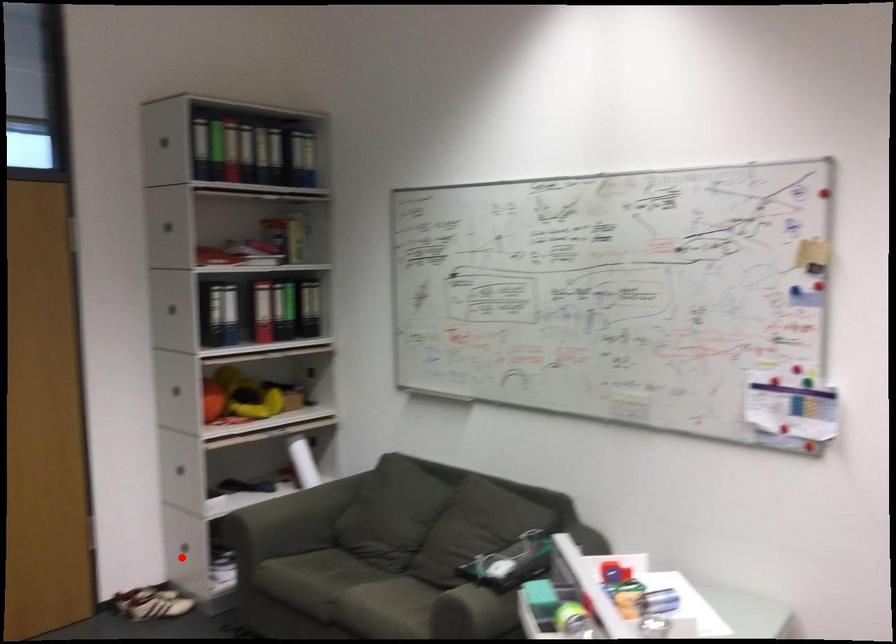
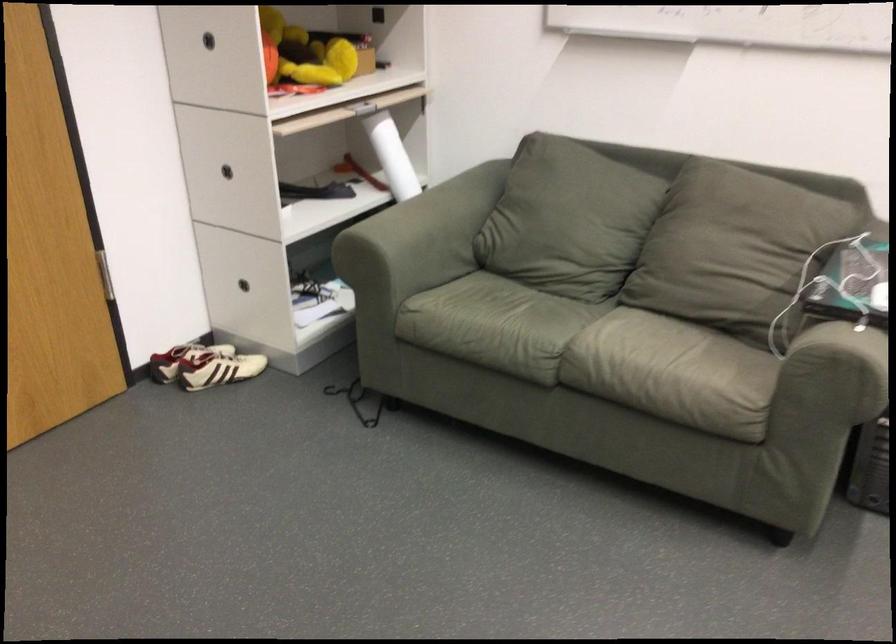
In the second image, find the point that corresponds to the highlighted location in the first image.

(252, 283)